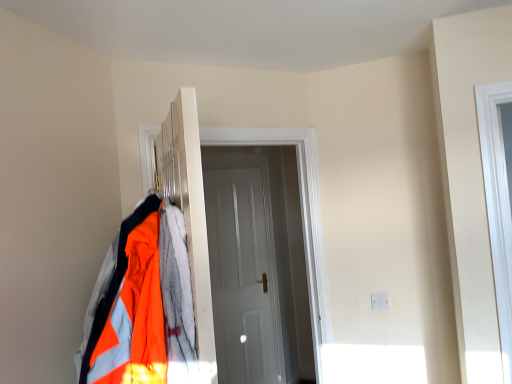
Measure the distance between white matte door at center, which is counted as the second door, starting from the front, and camera.

A distance of 10.91 feet exists between white matte door at center, which is counted as the second door, starting from the front, and camera.

Locate an element on the screen. The height and width of the screenshot is (384, 512). white glossy door at center, the first door in the front-to-back sequence is located at coordinates (205, 222).

Which is closer to the camera, (231, 336) or (311, 140)?

Point (231, 336) appears to be farther away from the viewer than point (311, 140).

Looking at this image, in terms of size, does white matte door at center, which is counted as the second door, starting from the front, appear bigger or smaller than white glossy door at center, the first door in the front-to-back sequence?

In the image, white matte door at center, which is counted as the second door, starting from the front, appears to be smaller than white glossy door at center, the first door in the front-to-back sequence.

From a real-world perspective, relative to white glossy door at center, positioned as the second door in back-to-front order, is white matte door at center, marked as the first door in a back-to-front arrangement, vertically above or below?

white matte door at center, marked as the first door in a back-to-front arrangement, is below white glossy door at center, positioned as the second door in back-to-front order.

Which object is further away from the camera, white matte door at center, marked as the first door in a back-to-front arrangement, or white glossy door at center, positioned as the second door in back-to-front order?

white matte door at center, marked as the first door in a back-to-front arrangement, is further from the camera.

Relative to white glossy door at center, the first door in the front-to-back sequence, is metallic silver coat rack at center in front or behind?

Visually, metallic silver coat rack at center is located in front of white glossy door at center, the first door in the front-to-back sequence.

Could you measure the distance between metallic silver coat rack at center and white glossy door at center, positioned as the second door in back-to-front order?

metallic silver coat rack at center and white glossy door at center, positioned as the second door in back-to-front order, are 33.71 inches apart.

Can you tell me how much metallic silver coat rack at center and white glossy door at center, positioned as the second door in back-to-front order, differ in facing direction?

The angular difference between metallic silver coat rack at center and white glossy door at center, positioned as the second door in back-to-front order, is 82.4 degrees.

Is metallic silver coat rack at center situated inside white glossy door at center, positioned as the second door in back-to-front order, or outside?

metallic silver coat rack at center is not enclosed by white glossy door at center, positioned as the second door in back-to-front order.

Visually, is white matte door at center, which is counted as the second door, starting from the front, positioned to the left or to the right of reflective fabric jacket at left?

Based on their positions, white matte door at center, which is counted as the second door, starting from the front, is located to the right of reflective fabric jacket at left.

In the scene shown: In terms of size, does white matte door at center, which is counted as the second door, starting from the front, appear bigger or smaller than reflective fabric jacket at left?

Clearly, white matte door at center, which is counted as the second door, starting from the front, is smaller in size than reflective fabric jacket at left.

From the image's perspective, is white matte door at center, which is counted as the second door, starting from the front, beneath reflective fabric jacket at left?

Indeed, from the image's perspective, white matte door at center, which is counted as the second door, starting from the front, is shown beneath reflective fabric jacket at left.

From a real-world perspective, who is located higher, white matte door at center, which is counted as the second door, starting from the front, or reflective fabric jacket at left?

reflective fabric jacket at left, from a real-world perspective.

How far apart are white glossy door at center, the first door in the front-to-back sequence, and white matte door at center, marked as the first door in a back-to-front arrangement?

white glossy door at center, the first door in the front-to-back sequence, is 4.16 feet away from white matte door at center, marked as the first door in a back-to-front arrangement.

Identify the location of door above the white matte door at center, which is counted as the second door, starting from the front (from a real-world perspective). (205, 222).

From their relative heights in the image, would you say white glossy door at center, the first door in the front-to-back sequence, is taller or shorter than white matte door at center, which is counted as the second door, starting from the front?

white glossy door at center, the first door in the front-to-back sequence, is shorter than white matte door at center, which is counted as the second door, starting from the front.

From the image's perspective, would you say white glossy door at center, the first door in the front-to-back sequence, is shown under white matte door at center, which is counted as the second door, starting from the front?

No.

From a real-world perspective, who is located lower, metallic silver coat rack at center or reflective fabric jacket at left?

reflective fabric jacket at left is physically lower.

Is metallic silver coat rack at center at the left side of reflective fabric jacket at left?

No, metallic silver coat rack at center is not to the left of reflective fabric jacket at left.

From the picture: Which of these two, reflective fabric jacket at left or white matte door at center, which is counted as the second door, starting from the front, stands shorter?

reflective fabric jacket at left.

Considering the relative sizes of reflective fabric jacket at left and white matte door at center, marked as the first door in a back-to-front arrangement, in the image provided, is reflective fabric jacket at left smaller than white matte door at center, marked as the first door in a back-to-front arrangement,?

No, reflective fabric jacket at left is not smaller than white matte door at center, marked as the first door in a back-to-front arrangement.

Is there a large distance between reflective fabric jacket at left and white matte door at center, which is counted as the second door, starting from the front?

Yes, reflective fabric jacket at left and white matte door at center, which is counted as the second door, starting from the front, are located far from each other.

How many degrees apart are the facing directions of reflective fabric jacket at left and white matte door at center, marked as the first door in a back-to-front arrangement?

95.3 degrees separate the facing orientations of reflective fabric jacket at left and white matte door at center, marked as the first door in a back-to-front arrangement.

From a real-world perspective, is white matte door at center, marked as the first door in a back-to-front arrangement, located beneath metallic silver coat rack at center?

Yes, from a real-world perspective, white matte door at center, marked as the first door in a back-to-front arrangement, is under metallic silver coat rack at center.

Does white matte door at center, marked as the first door in a back-to-front arrangement, touch metallic silver coat rack at center?

There is a gap between white matte door at center, marked as the first door in a back-to-front arrangement, and metallic silver coat rack at center.

From the image's perspective, between white matte door at center, which is counted as the second door, starting from the front, and metallic silver coat rack at center, who is located below?

white matte door at center, which is counted as the second door, starting from the front.

Is white matte door at center, which is counted as the second door, starting from the front, positioned with its back to metallic silver coat rack at center?

No, white matte door at center, which is counted as the second door, starting from the front, is not facing the opposite direction of metallic silver coat rack at center.

Image resolution: width=512 pixels, height=384 pixels. Find the location of `door behind the white glossy door at center, positioned as the second door in back-to-front order`. door behind the white glossy door at center, positioned as the second door in back-to-front order is located at coordinates (243, 276).

The image size is (512, 384). I want to click on closet above the white glossy door at center, the first door in the front-to-back sequence (from a real-world perspective), so click(x=187, y=209).

Looking at the image, which one is located closer to reflective fabric jacket at left, white matte door at center, marked as the first door in a back-to-front arrangement, or metallic silver coat rack at center?

metallic silver coat rack at center is positioned closer to the anchor reflective fabric jacket at left.

Which object lies further to the anchor point reflective fabric jacket at left, metallic silver coat rack at center or white matte door at center, marked as the first door in a back-to-front arrangement?

Based on the image, white matte door at center, marked as the first door in a back-to-front arrangement, appears to be further to reflective fabric jacket at left.

Considering their positions, is metallic silver coat rack at center positioned further to white glossy door at center, positioned as the second door in back-to-front order, than reflective fabric jacket at left?

The object further to white glossy door at center, positioned as the second door in back-to-front order, is metallic silver coat rack at center.

When comparing their distances from white matte door at center, which is counted as the second door, starting from the front, does white glossy door at center, the first door in the front-to-back sequence, or reflective fabric jacket at left seem closer?

white glossy door at center, the first door in the front-to-back sequence, is positioned closer to the anchor white matte door at center, which is counted as the second door, starting from the front.

Considering their positions, is white glossy door at center, the first door in the front-to-back sequence, positioned closer to reflective fabric jacket at left than white matte door at center, marked as the first door in a back-to-front arrangement?

white glossy door at center, the first door in the front-to-back sequence, is closer to reflective fabric jacket at left.

Based on the photo, from the image, which object appears to be farther from white glossy door at center, positioned as the second door in back-to-front order, white matte door at center, which is counted as the second door, starting from the front, or reflective fabric jacket at left?

Among the two, white matte door at center, which is counted as the second door, starting from the front, is located further to white glossy door at center, positioned as the second door in back-to-front order.

Based on their spatial positions, is metallic silver coat rack at center or white matte door at center, which is counted as the second door, starting from the front, closer to white glossy door at center, the first door in the front-to-back sequence?

metallic silver coat rack at center lies closer to white glossy door at center, the first door in the front-to-back sequence, than the other object.

Estimate the real-world distances between objects in this image. Which object is closer to white matte door at center, marked as the first door in a back-to-front arrangement, reflective fabric jacket at left or white glossy door at center, the first door in the front-to-back sequence?

white glossy door at center, the first door in the front-to-back sequence, is positioned closer to the anchor white matte door at center, marked as the first door in a back-to-front arrangement.

Locate an element on the screen. The image size is (512, 384). door between metallic silver coat rack at center and white matte door at center, which is counted as the second door, starting from the front, from front to back is located at coordinates (205, 222).

At what (x,y) coordinates should I click in order to perform the action: click on door between reflective fabric jacket at left and white matte door at center, marked as the first door in a back-to-front arrangement, along the z-axis. Please return your answer as a coordinate pair (x, y). The image size is (512, 384). Looking at the image, I should click on (205, 222).

At what (x,y) coordinates should I click in order to perform the action: click on closet between reflective fabric jacket at left and white matte door at center, which is counted as the second door, starting from the front, from front to back. Please return your answer as a coordinate pair (x, y). This screenshot has width=512, height=384. Looking at the image, I should click on (187, 209).

The height and width of the screenshot is (384, 512). Identify the location of closet between reflective fabric jacket at left and white glossy door at center, positioned as the second door in back-to-front order, from front to back. (187, 209).